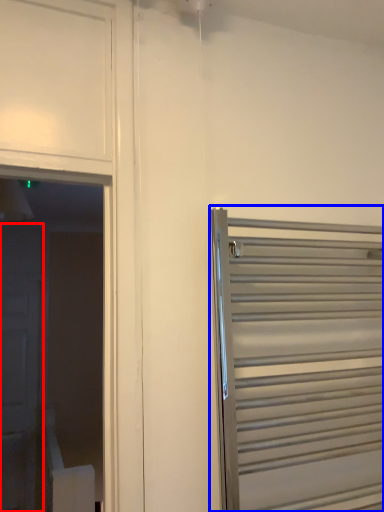
Question: Which object is further to the camera taking this photo, door (highlighted by a red box) or door (highlighted by a blue box)?

Choices:
 (A) door
 (B) door

Answer: (A)